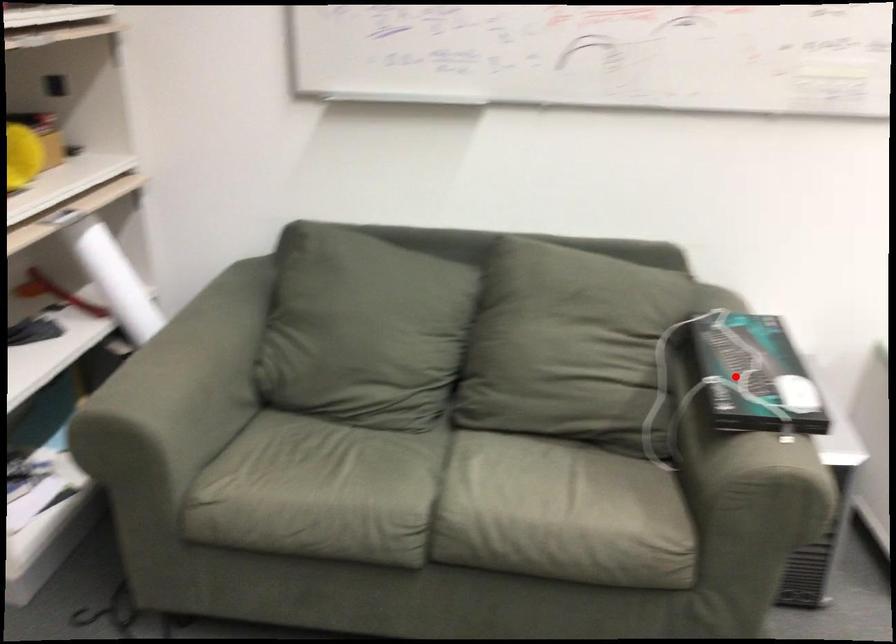
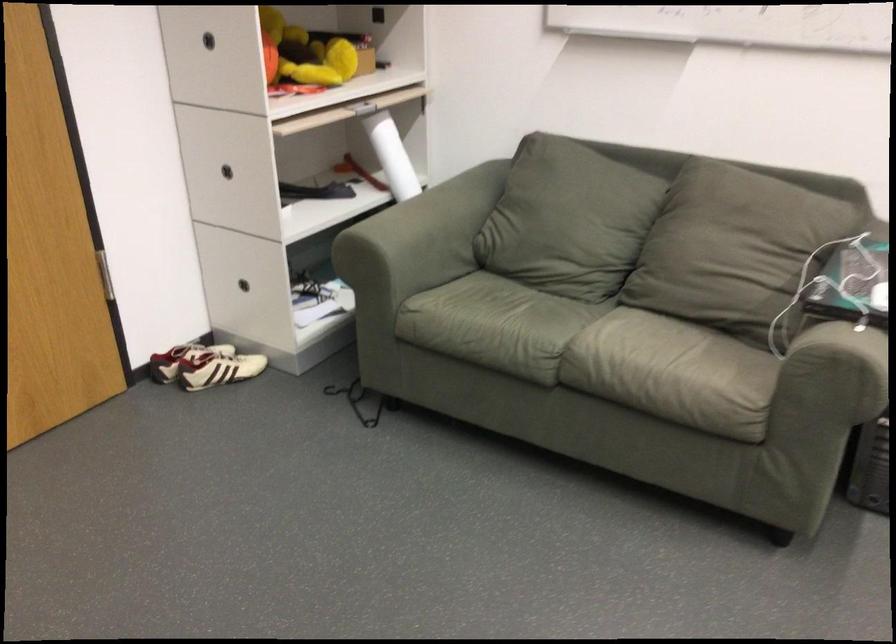
Question: I am providing you with two images of the same scene from different viewpoints. In image1, a red point is highlighted. Considering the same 3D point in image2, which of the following is correct?

Choices:
 (A) It is closer
 (B) It is farther

Answer: (B)